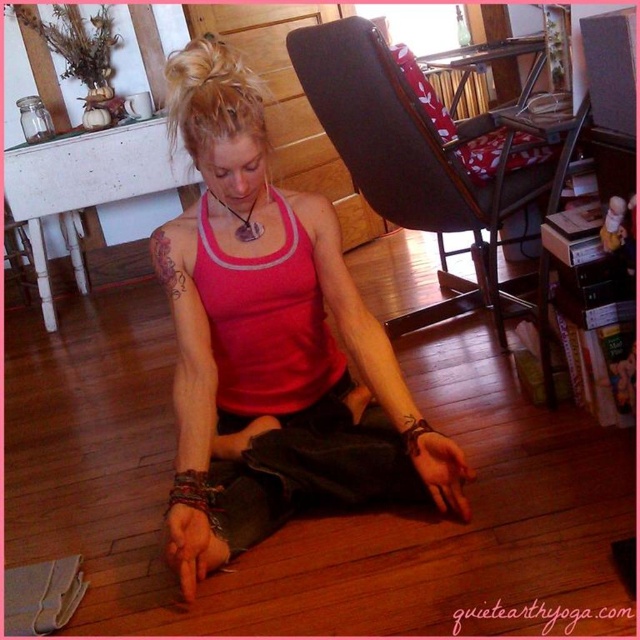
You are standing in the room and want to place a small plant on the dark brown leather chair at center. Based on the 2D coordinates provided, where exactly should you place the plant?

The dark brown leather chair at center is located at the 2D coordinates point (x=419, y=160), so you should place the small plant there.

You are a photographer taking a picture of the person in the yoga pose. You want to focus on the pink fabric tank top at center and the brown ink tattoo at upper left. Which object will appear larger in the photo?

The pink fabric tank top at center will appear larger in the photo because it is closer to the viewer than the brown ink tattoo at upper left.

You are a photographer taking a picture of the person doing yoga. You want to ensure that both the pink fabric tank top at center and the blondehair at center are clearly visible in the frame. Based on their positions, which object should you focus on first to capture both in the shot?

Since the pink fabric tank top at center is to the right of blondehair at center, you should focus on the blondehair at center first as it is on the left side, ensuring both objects remain within the frame when centered.